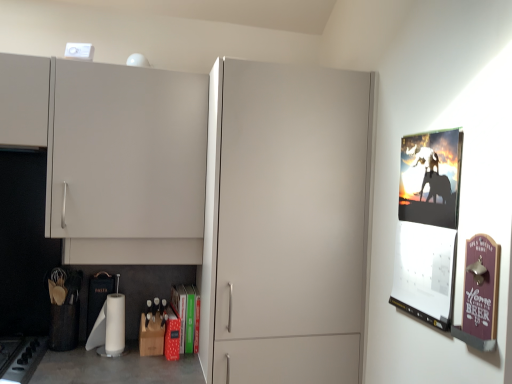
Question: Is white matte toilet paper at lower center directly adjacent to green matte book at lower center?

Choices:
 (A) yes
 (B) no

Answer: (B)

Question: Is white matte toilet paper at lower center far away from green matte book at lower center?

Choices:
 (A) no
 (B) yes

Answer: (A)

Question: From a real-world perspective, is white matte toilet paper at lower center under green matte book at lower center?

Choices:
 (A) yes
 (B) no

Answer: (A)

Question: Does white matte toilet paper at lower center appear on the right side of green matte book at lower center?

Choices:
 (A) no
 (B) yes

Answer: (A)

Question: From the image's perspective, does white matte toilet paper at lower center appear lower than green matte book at lower center?

Choices:
 (A) no
 (B) yes

Answer: (A)

Question: Considering their positions, is silhouette paper poster at right, positioned as the 1th poster page in back-to-front order, located in front of or behind matte white cabinet at upper left?

Choices:
 (A) front
 (B) behind

Answer: (A)

Question: In terms of height, does silhouette paper poster at right, positioned as the 1th poster page in back-to-front order, look taller or shorter compared to matte white cabinet at upper left?

Choices:
 (A) tall
 (B) short

Answer: (B)

Question: From a real-world perspective, is silhouette paper poster at right, positioned as the 1th poster page in back-to-front order, positioned above or below matte white cabinet at upper left?

Choices:
 (A) above
 (B) below

Answer: (B)

Question: Would you say silhouette paper poster at right, positioned as the 1th poster page in back-to-front order, is inside or outside matte white cabinet at upper left?

Choices:
 (A) outside
 (B) inside

Answer: (A)

Question: From the image's perspective, is white matte toilet paper at lower center positioned above or below purple wood sign at right, the first poster page viewed from the front?

Choices:
 (A) below
 (B) above

Answer: (A)

Question: Considering the positions of white matte toilet paper at lower center and purple wood sign at right, the first poster page viewed from the front, in the image, is white matte toilet paper at lower center taller or shorter than purple wood sign at right, the first poster page viewed from the front,?

Choices:
 (A) tall
 (B) short

Answer: (B)

Question: Choose the correct answer: Is white matte toilet paper at lower center inside purple wood sign at right, the first poster page viewed from the front, or outside it?

Choices:
 (A) inside
 (B) outside

Answer: (B)

Question: Would you say white matte toilet paper at lower center is to the left or to the right of purple wood sign at right, which is the second poster page from back to front, in the picture?

Choices:
 (A) left
 (B) right

Answer: (A)

Question: In terms of width, does white matte toilet paper at lower center look wider or thinner when compared to matte white cabinet at center?

Choices:
 (A) wide
 (B) thin

Answer: (B)

Question: Would you say white matte toilet paper at lower center is to the left or to the right of matte white cabinet at center in the picture?

Choices:
 (A) left
 (B) right

Answer: (A)